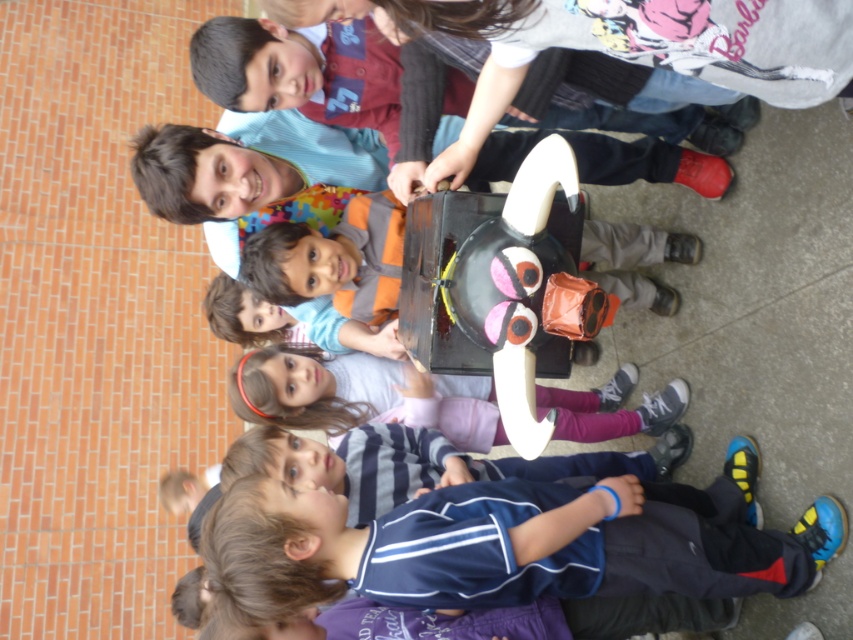
Which of these two, pink fabric dress at center or striped cotton shirt at lower center, stands taller?

pink fabric dress at center

Does pink fabric dress at center have a lesser height compared to striped cotton shirt at lower center?

In fact, pink fabric dress at center may be taller than striped cotton shirt at lower center.

Consider the image. Who is more distant from viewer, (252,356) or (383,460)?

The point (252,356) is behind.

Identify the location of pink fabric dress at center. The image size is (853, 640). (357, 396).

Who is lower down, matte black backpack at upper center or matte orange shirt at center?

matte orange shirt at center

Locate an element on the screen. This screenshot has width=853, height=640. matte black backpack at upper center is located at coordinates (300, 72).

What do you see at coordinates (300, 72) in the screenshot?
I see `matte black backpack at upper center` at bounding box center [300, 72].

Does matte black backpack at upper center have a larger size compared to striped cotton shirt at lower center?

Correct, matte black backpack at upper center is larger in size than striped cotton shirt at lower center.

Between point (737, 102) and point (419, 488), which one is positioned behind?

Positioned behind is point (737, 102).

This screenshot has height=640, width=853. Identify the location of matte black backpack at upper center. (300, 72).